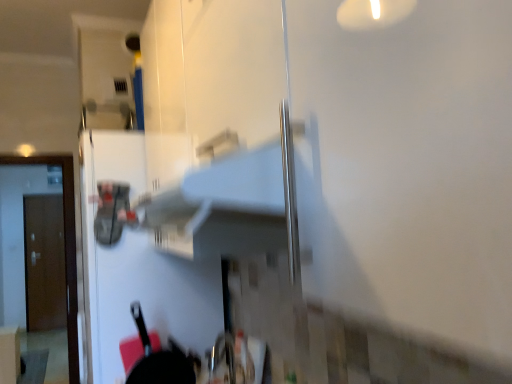
Where is `brown wooden door at left`? brown wooden door at left is located at coordinates (44, 262).

This screenshot has width=512, height=384. What do you see at coordinates (44, 262) in the screenshot? I see `brown wooden door at left` at bounding box center [44, 262].

The width and height of the screenshot is (512, 384). I want to click on brown wooden door at left, so [x=44, y=262].